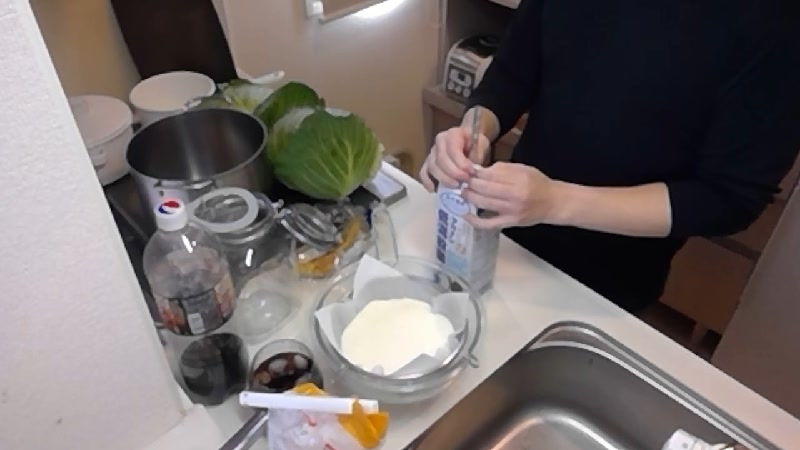
Where is `glass with ice`? This screenshot has height=450, width=800. glass with ice is located at coordinates (296, 360).